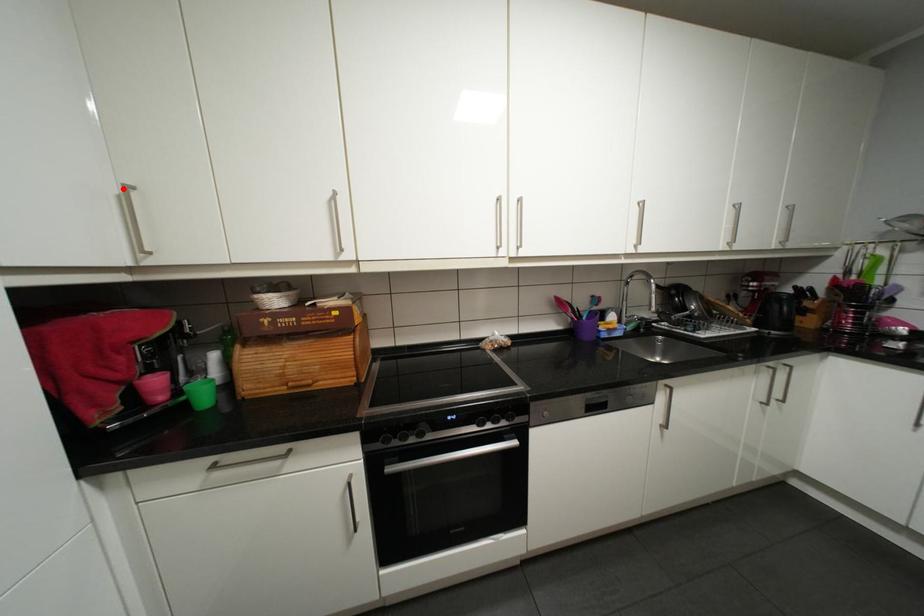
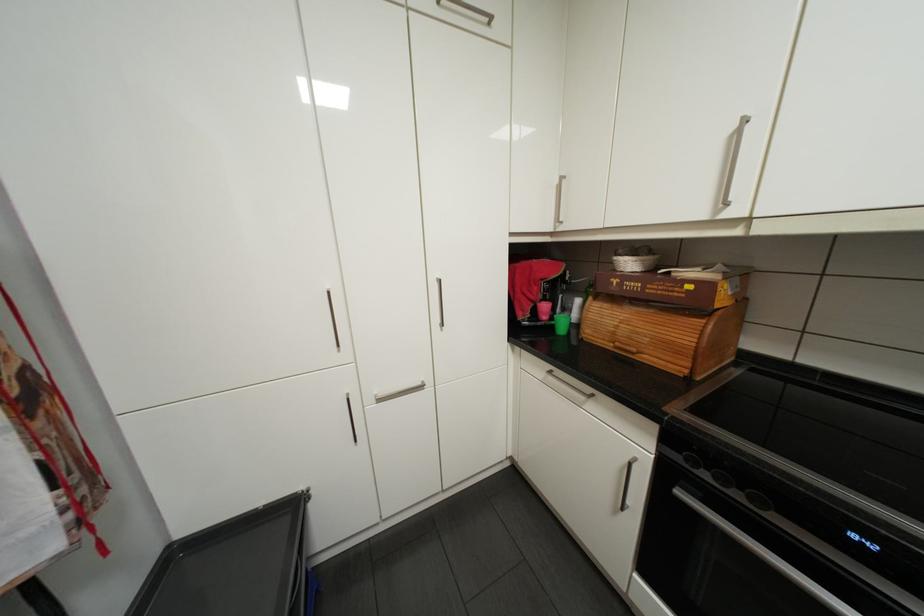
Where in the second image is the point corresponding to the highlighted location from the first image?

(565, 180)